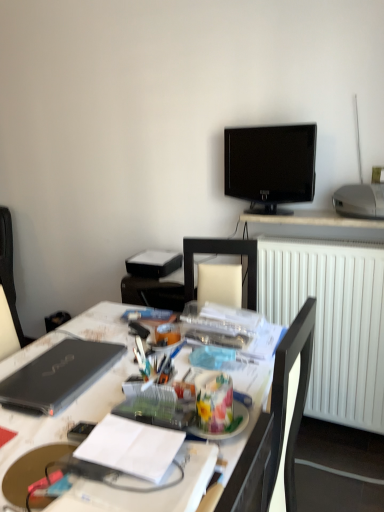
Question: Can you confirm if black glossy tv at upper center is positioned to the right of translucent plastic container at center?

Choices:
 (A) yes
 (B) no

Answer: (A)

Question: Does black glossy tv at upper center come in front of translucent plastic container at center?

Choices:
 (A) yes
 (B) no

Answer: (B)

Question: From the image's perspective, is black glossy tv at upper center beneath translucent plastic container at center?

Choices:
 (A) no
 (B) yes

Answer: (A)

Question: From a real-world perspective, is black glossy tv at upper center located higher than translucent plastic container at center?

Choices:
 (A) yes
 (B) no

Answer: (A)

Question: Is the depth of black glossy tv at upper center greater than that of translucent plastic container at center?

Choices:
 (A) yes
 (B) no

Answer: (A)

Question: Does black glossy tv at upper center have a lesser width compared to translucent plastic container at center?

Choices:
 (A) no
 (B) yes

Answer: (B)

Question: Is black matte laptop at left positioned in front of silver metallic projector at upper right?

Choices:
 (A) yes
 (B) no

Answer: (A)

Question: Could you tell me if black matte laptop at left is turned towards silver metallic projector at upper right?

Choices:
 (A) no
 (B) yes

Answer: (A)

Question: Would you consider black matte laptop at left to be distant from silver metallic projector at upper right?

Choices:
 (A) yes
 (B) no

Answer: (A)

Question: Is silver metallic projector at upper right located within black matte laptop at left?

Choices:
 (A) no
 (B) yes

Answer: (A)

Question: Is black matte laptop at left thinner than silver metallic projector at upper right?

Choices:
 (A) yes
 (B) no

Answer: (A)

Question: Does black matte laptop at left have a greater width compared to silver metallic projector at upper right?

Choices:
 (A) yes
 (B) no

Answer: (B)

Question: Does dark gray fabric computer chair at left have a larger size compared to black glossy tv at upper center?

Choices:
 (A) no
 (B) yes

Answer: (B)